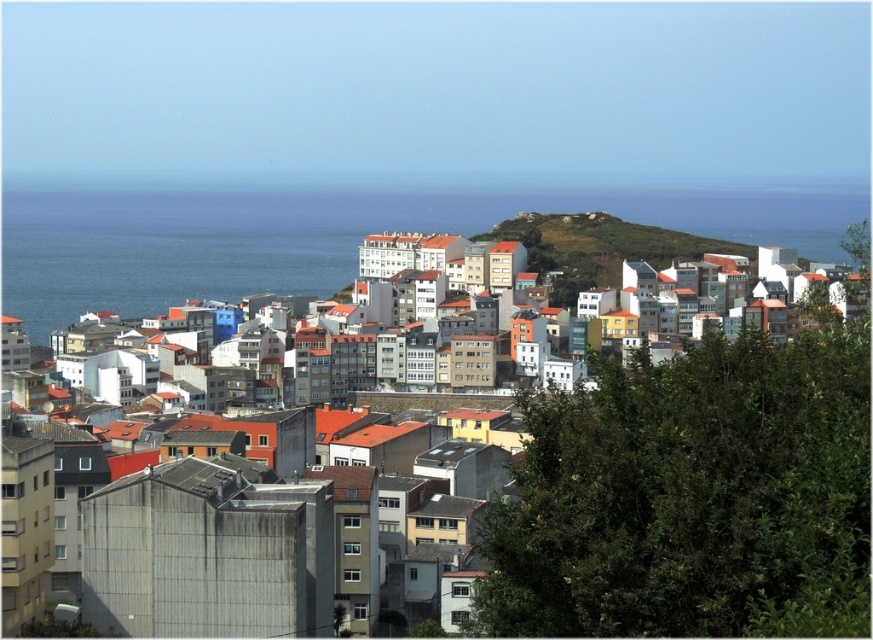
Question: Does white matte building at center have a greater width compared to green grassy hillside at center?

Choices:
 (A) yes
 (B) no

Answer: (A)

Question: Considering the relative positions of white matte building at center and blue water at center in the image provided, where is white matte building at center located with respect to blue water at center?

Choices:
 (A) left
 (B) right

Answer: (B)

Question: Which point is closer to the camera?

Choices:
 (A) (762, 525)
 (B) (122, 248)

Answer: (A)

Question: Which of the following is the closest to the observer?

Choices:
 (A) blue water at center
 (B) green grassy hillside at center
 (C) white matte building at center

Answer: (C)

Question: Among these points, which one is nearest to the camera?

Choices:
 (A) (630, 259)
 (B) (21, 227)
 (C) (650, 474)

Answer: (C)

Question: Does blue water at center have a smaller size compared to green grassy hillside at center?

Choices:
 (A) yes
 (B) no

Answer: (B)